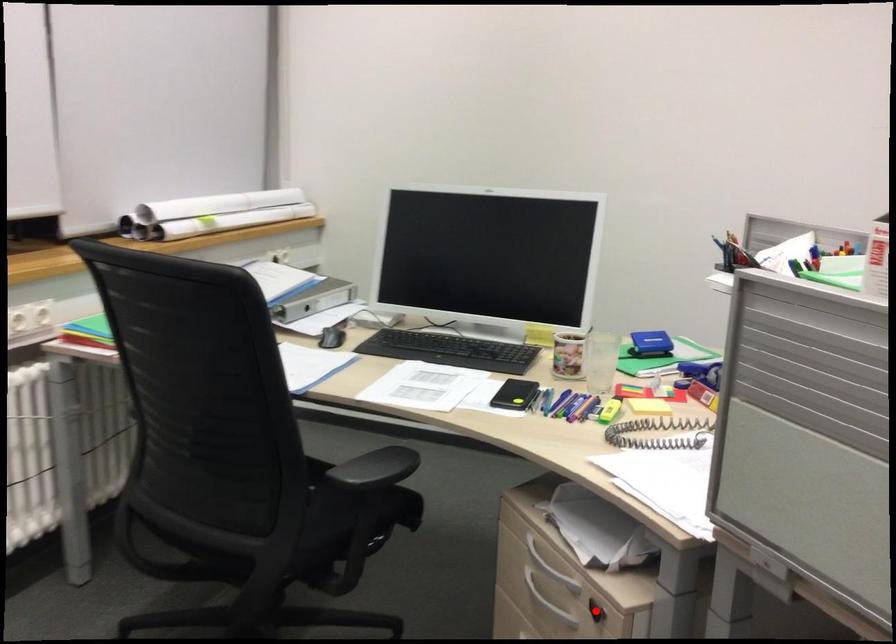
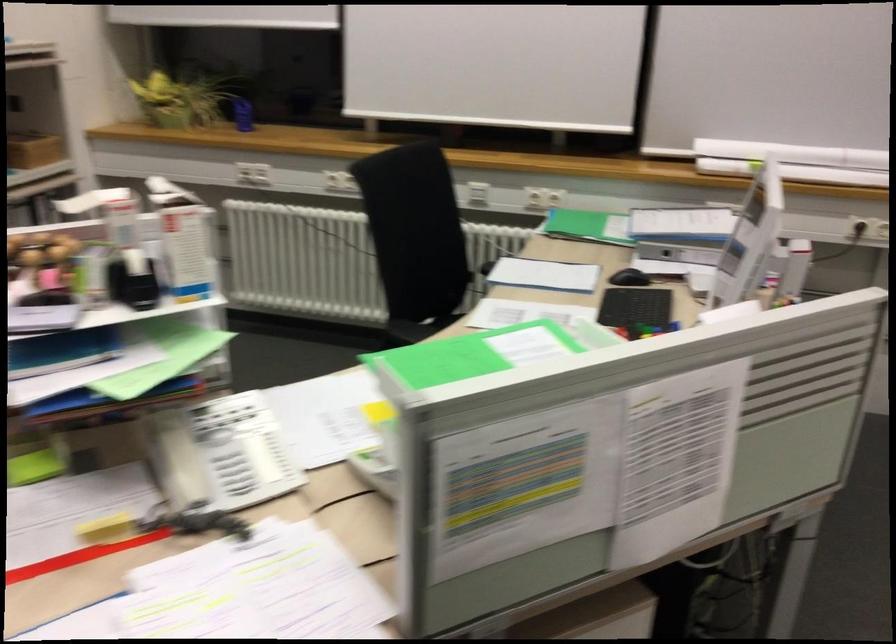
Question: I am providing you with two images of the same scene from different viewpoints. A red point is marked on the first image. Can you still see the location of the red point in image 2?

Choices:
 (A) Yes
 (B) No

Answer: (B)